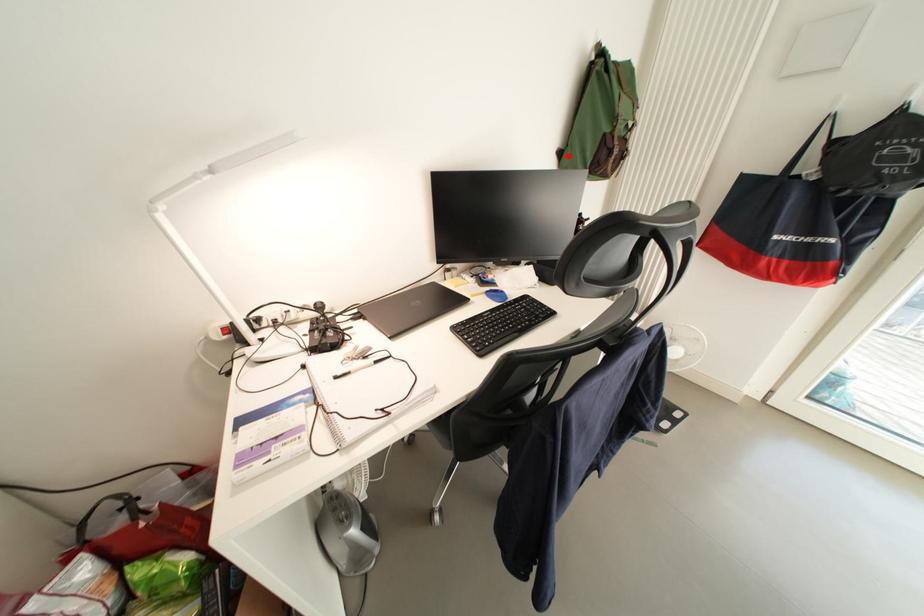
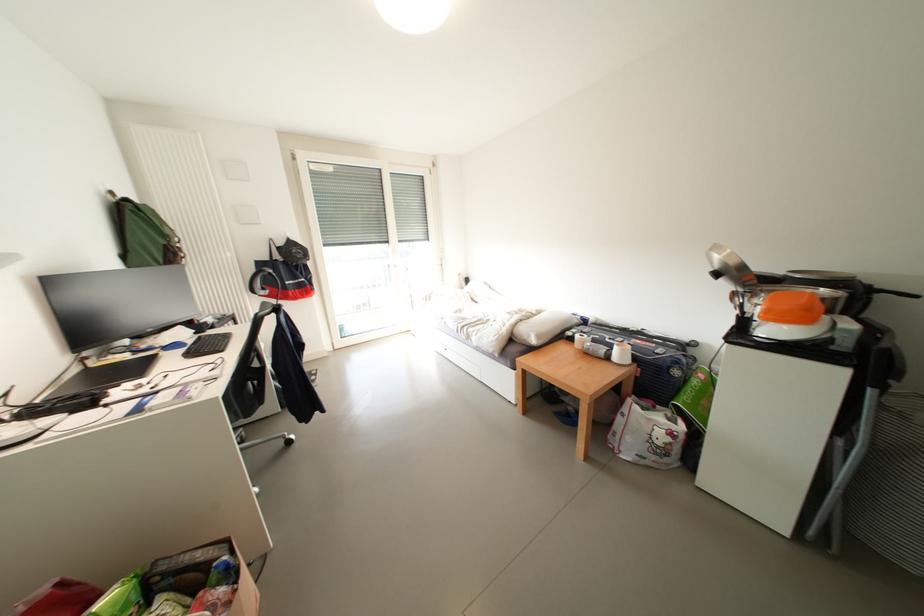
Find the pixel in the second image that matches the highlighted location in the first image.

(131, 259)